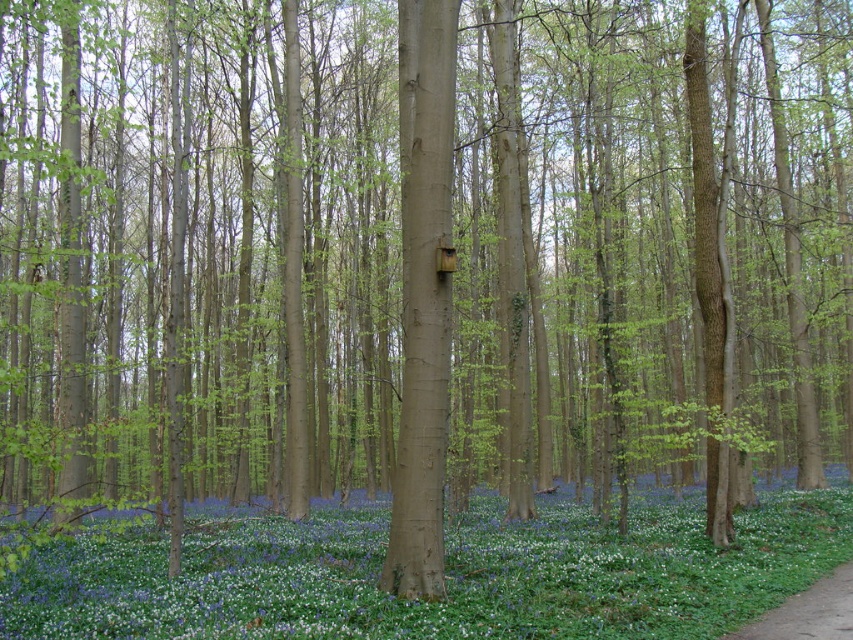
You are a hiker carrying a backpack and need to reach the brown dirt path at lower right from your current position near the blue matte flower at center. Based on the distance provided, can you estimate whether you can comfortably walk directly to the path without needing to detour around any obstacles?

The distance between the blue matte flower at center and the brown dirt path at lower right is 18.44 feet. Since there are no obstacles mentioned in the scene description, you can comfortably walk directly to the path without needing to detour.

Looking at this image, you are a hiker who wants to pick the blue matte flower at center. You are currently standing on the brown dirt path at lower right. Can you reach the flower without stepping off the path?

The blue matte flower at center is below the brown dirt path at lower right, so you can reach it while standing on the path without needing to step off.